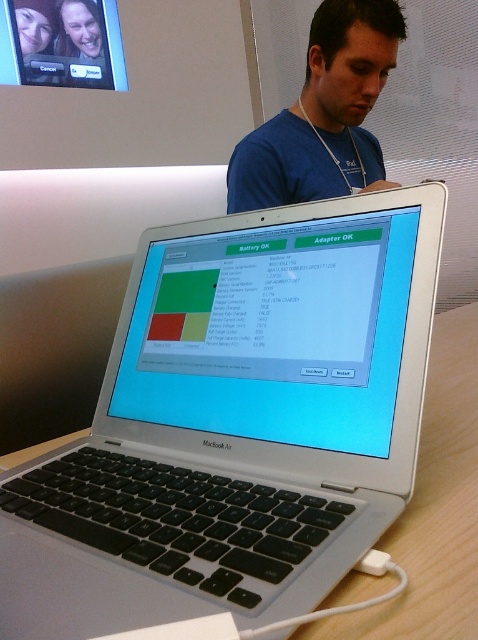
You are a photographer taking a picture of the MacBook Air laptop. You notice two points on the laptop screen labeled as point (257, 240) and point (347, 13). Which point will appear larger in your photo?

Point (257, 240) will appear larger in the photo because it is closer to the camera than point (347, 13).

You are organizing a workspace and need to place both the silver metallic laptop at center and the blue fabric shirt at center on the desk. Given their sizes, which item should you place first to ensure both fit comfortably?

The silver metallic laptop at center occupies less space than the blue fabric shirt at center. Therefore, you should place the blue fabric shirt at center first to ensure there is enough space left for the smaller laptop.